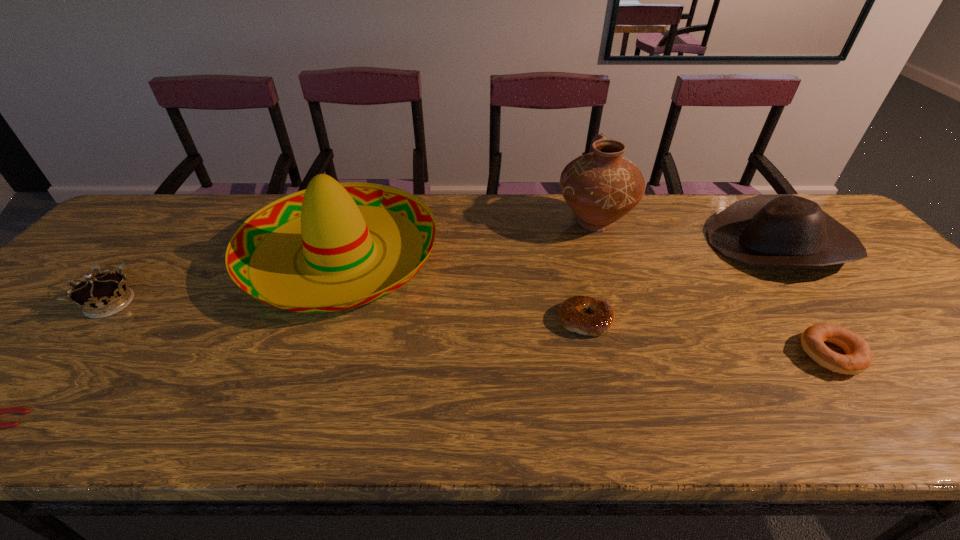
Where is `blank region between the third tallest object and the sombrero`? blank region between the third tallest object and the sombrero is located at coordinates (560, 249).

Identify which object is the second nearest to the cowboy hat. Please provide its 2D coordinates. Your answer should be formatted as a tuple, i.e. [(x, y)], where the tuple contains the x and y coordinates of a point satisfying the conditions above.

[(600, 187)]

Choose which object is the sixth nearest neighbor to the shorter bagel. Please provide its 2D coordinates. Your answer should be formatted as a tuple, i.e. [(x, y)], where the tuple contains the x and y coordinates of a point satisfying the conditions above.

[(12, 409)]